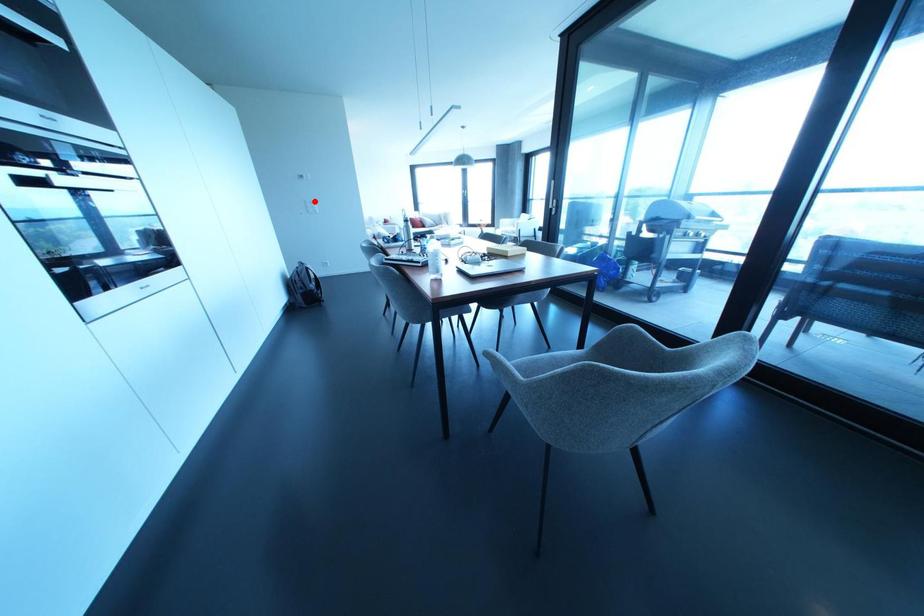
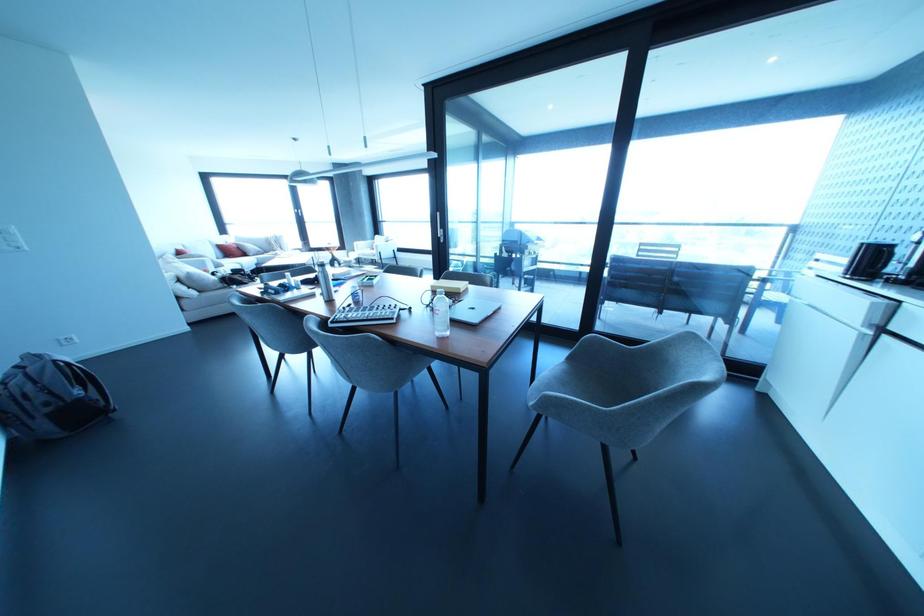
Question: I am providing you with two images of the same scene from different viewpoints. A red point is shown in image1. For the corresponding object point in image2, is it positioned nearer or farther from the camera?

Choices:
 (A) Nearer
 (B) Farther

Answer: (B)